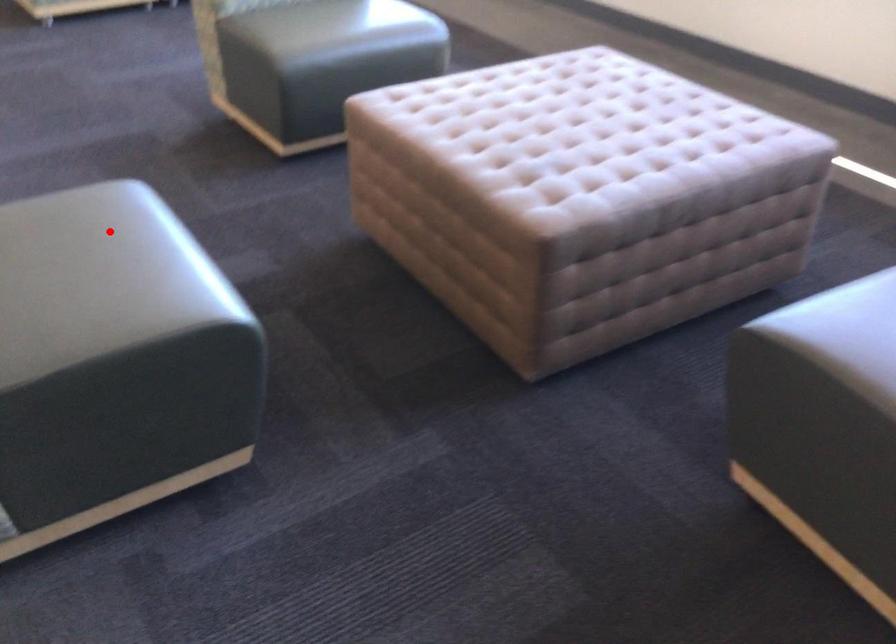
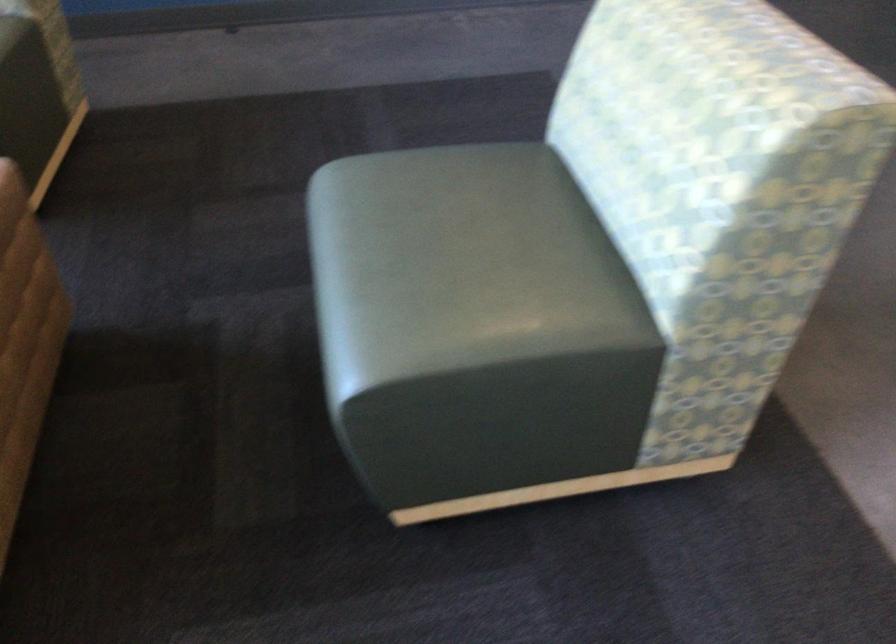
Question: I am providing you with two images of the same scene from different viewpoints. Given a red point in image1, look at the same physical point in image2. Is it:

Choices:
 (A) Closer to the viewpoint
 (B) Farther from the viewpoint

Answer: (A)